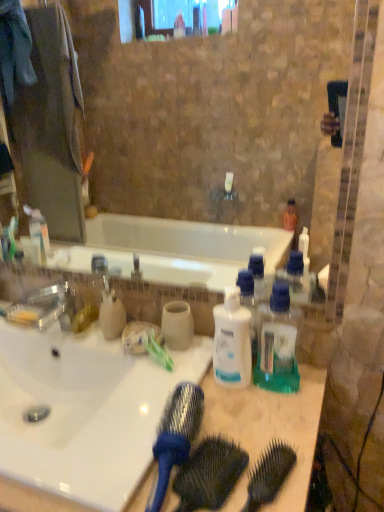
Find the location of a particular element. Image resolution: width=384 pixels, height=512 pixels. free space that is in between black plastic brush at center, acting as the 1th brush starting from the right, and translucent green plastic at center, which appears as the 2th bottle when viewed from the left is located at coordinates (270, 426).